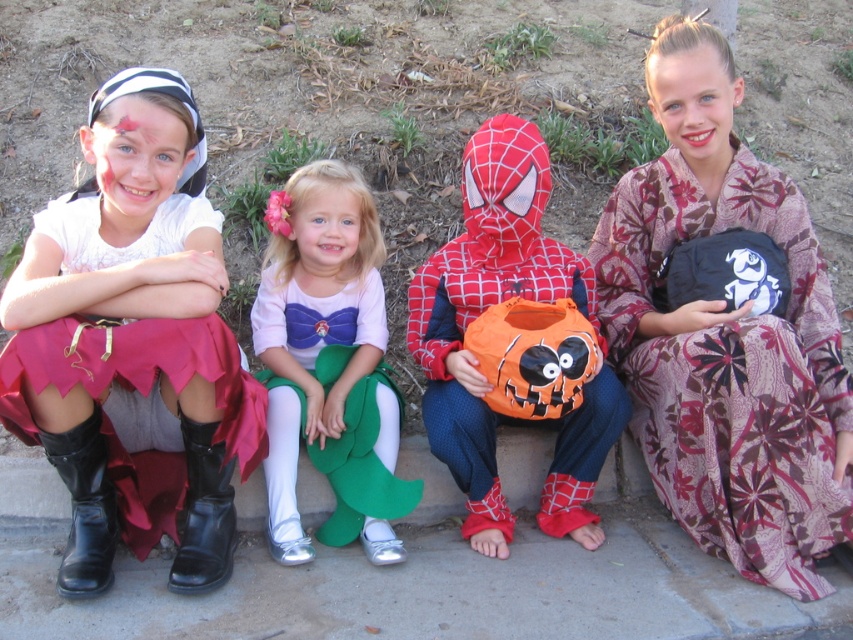
Question: Can you confirm if matte black boots at lower left is positioned to the left of black fabric bag at right?

Choices:
 (A) yes
 (B) no

Answer: (A)

Question: Which of the following is the closest to the observer?

Choices:
 (A) rubberized plastic pumpkin at center
 (B) pink satin dress at center
 (C) black fabric bag at right

Answer: (C)

Question: Based on their relative distances, which object is nearer to the pink satin dress at center?

Choices:
 (A) rubberized plastic pumpkin at center
 (B) black fabric bag at right

Answer: (A)

Question: Is matte black boots at lower left below black fabric bag at right?

Choices:
 (A) yes
 (B) no

Answer: (B)

Question: Estimate the real-world distances between objects in this image. Which object is closer to the pink satin dress at center?

Choices:
 (A) rubberized plastic pumpkin at center
 (B) matte black boots at lower left

Answer: (A)

Question: Observing the image, what is the correct spatial positioning of matte black boots at lower left in reference to pink satin dress at center?

Choices:
 (A) above
 (B) below

Answer: (A)